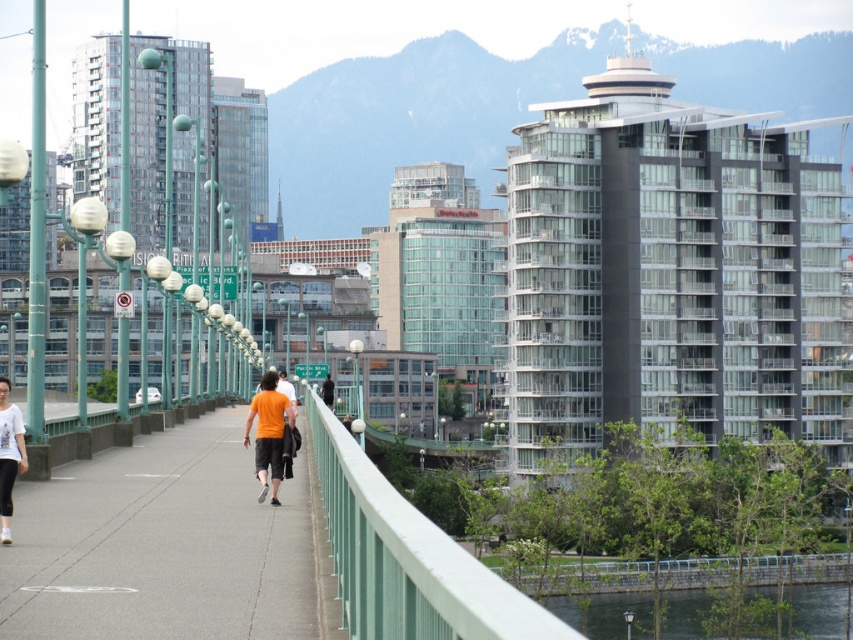
You are standing on the pedestrian bridge and want to take a photo of both the concrete sidewalk at center and the green stone wall at lower right. Which object should you focus on first to ensure both are in the frame?

You should focus on the concrete sidewalk at center first because it is closer to the viewer than the green stone wall at lower right, allowing both to be in the frame by adjusting the camera angle accordingly.

You are designing a new bench to place between the green painted metal railing at center and the green stone wall at lower right. Which object should the bench be closer to to ensure it fits within the available space?

The bench should be placed closer to the green painted metal railing at center because its width is narrower than the green stone wall at lower right, allowing more space for the bench to fit appropriately.

You are standing on the pedestrian bridge and notice the concrete sidewalk at center and the white matte shirt at left. Which object is positioned to the right of the other?

The concrete sidewalk at center is to the right of the white matte shirt at left according to the description.